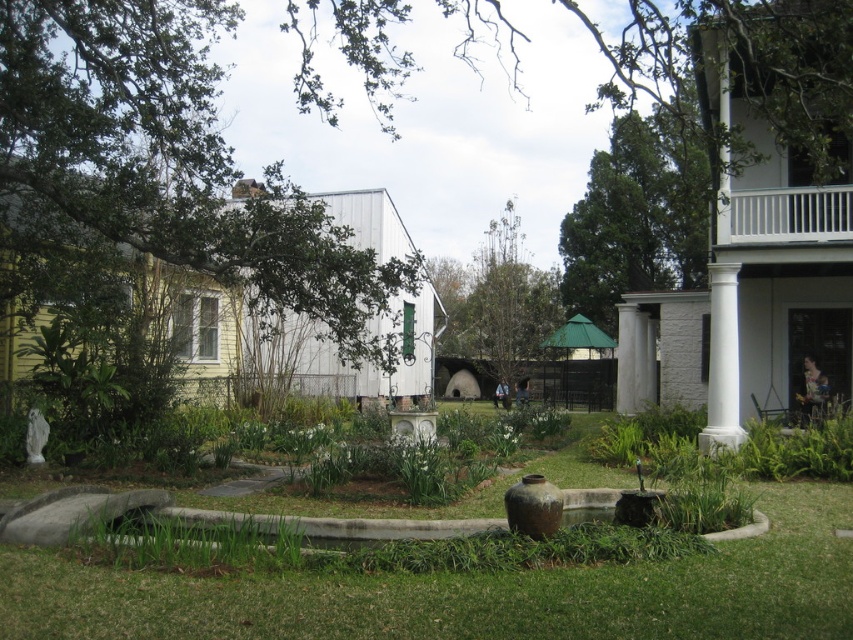
Between point (733, 216) and point (720, 435), which one is positioned behind?

The point (733, 216) is behind.

Between point (848, 202) and point (727, 371), which one is positioned behind?

Positioned behind is point (848, 202).

Image resolution: width=853 pixels, height=640 pixels. I want to click on white wooden porch at upper right, so click(787, 216).